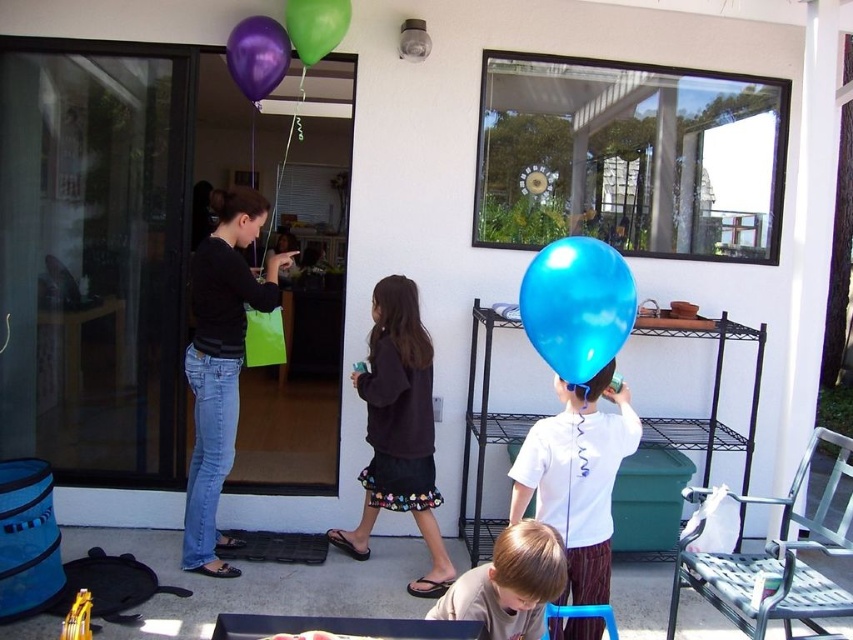
Question: Is transparent glass door at left above green rubber balloon at upper center?

Choices:
 (A) no
 (B) yes

Answer: (A)

Question: Which object is the farthest from the blue rubber balloon at center?

Choices:
 (A) green rubber balloon at upper center
 (B) metallic purple balloon at upper center
 (C) dark brown sweater at center
 (D) matte black shirt at left

Answer: (B)

Question: Where is blue rubber balloon at center located in relation to green rubber balloon at upper center in the image?

Choices:
 (A) left
 (B) right

Answer: (B)

Question: Based on their relative distances, which object is nearer to the white matte shirt at center?

Choices:
 (A) metallic purple balloon at upper center
 (B) blue rubber balloon at center
 (C) green rubber balloon at upper center

Answer: (B)

Question: From the image, what is the correct spatial relationship of brown cotton shirt at lower center in relation to metallic purple balloon at upper center?

Choices:
 (A) left
 (B) right

Answer: (B)

Question: Which of the following is the farthest from the observer?

Choices:
 (A) (569, 262)
 (B) (247, 68)
 (C) (357, 376)

Answer: (C)